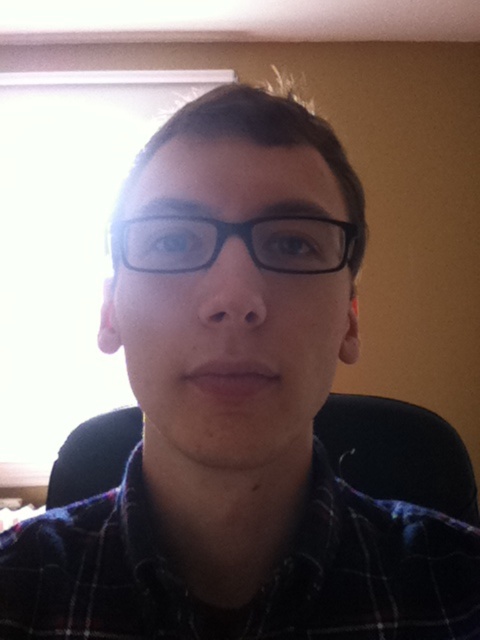
How much distance is there between black fabric swivel chair at center and black plastic glasses at center?

black fabric swivel chair at center is 1.10 meters from black plastic glasses at center.

Who is shorter, black fabric swivel chair at center or black plastic glasses at center?

black plastic glasses at center is shorter.

What do you see at coordinates (397, 452) in the screenshot?
I see `black fabric swivel chair at center` at bounding box center [397, 452].

Find the location of a particular element. Image resolution: width=480 pixels, height=640 pixels. black fabric swivel chair at center is located at coordinates (397, 452).

Is black matte glasses at center further to camera compared to black fabric swivel chair at center?

No, it is in front of black fabric swivel chair at center.

Find the location of a particular element. The height and width of the screenshot is (640, 480). black matte glasses at center is located at coordinates (229, 353).

Is plaid fabric at center to the right of black fabric swivel chair at center from the viewer's perspective?

In fact, plaid fabric at center is to the left of black fabric swivel chair at center.

Who is positioned more to the left, plaid fabric at center or black fabric swivel chair at center?

From the viewer's perspective, plaid fabric at center appears more on the left side.

Is point (4, 600) closer to camera compared to point (444, 432)?

Yes.

I want to click on plaid fabric at center, so click(260, 589).